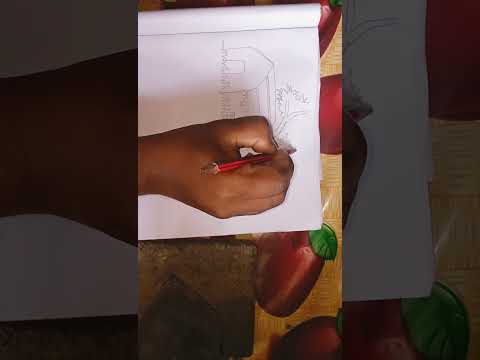
Find the location of `art picture`. art picture is located at coordinates (395, 222).